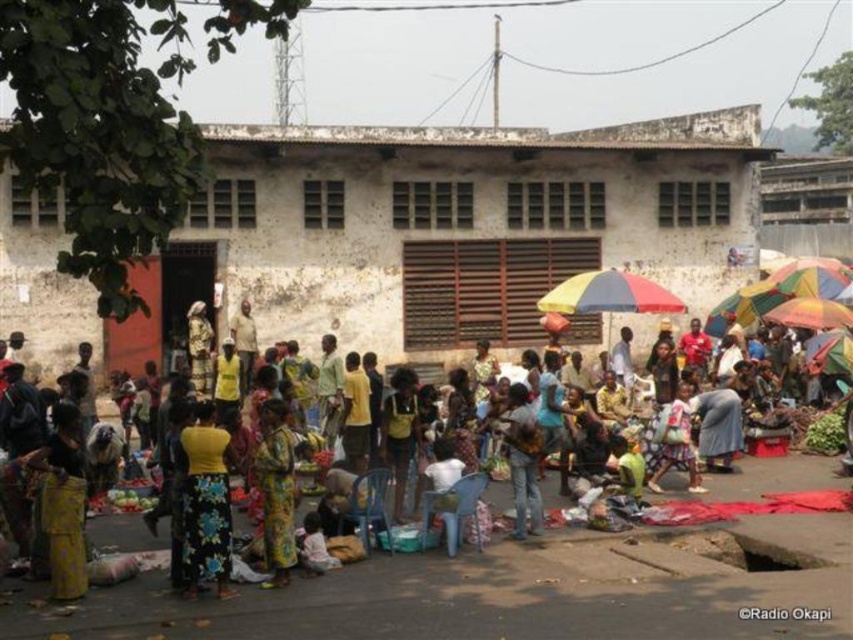
You are a vendor at the market and need to set up a new stall. The floral fabric market at center and the yellow fabric skirt at lower left are already present. Which area has more space available for your new stall?

The yellow fabric skirt at lower left has more space available because it occupies more space than the floral fabric market at center.